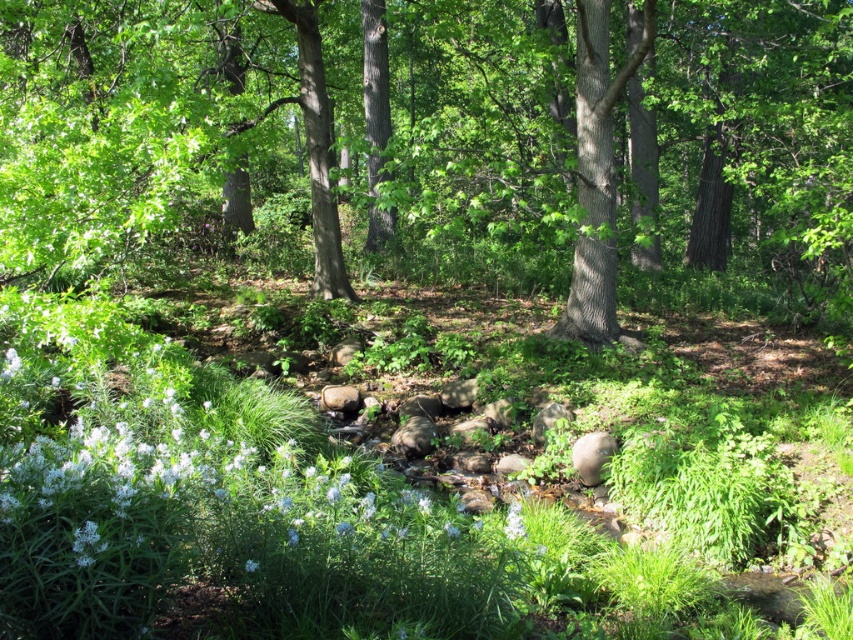
Question: Does green leafy tree at center have a larger size compared to white matte flower at center?

Choices:
 (A) no
 (B) yes

Answer: (B)

Question: Which point appears closest to the camera in this image?

Choices:
 (A) click(604, 17)
 (B) click(517, 524)
 (C) click(590, 70)

Answer: (B)

Question: Which of the following is the farthest from the observer?

Choices:
 (A) (508, 536)
 (B) (250, 560)
 (C) (560, 321)

Answer: (C)

Question: Which is farther from the smooth bark tree at center?

Choices:
 (A) white matte flower at center
 (B) white matte flower at lower center

Answer: (B)

Question: Does green leafy tree at center appear on the left side of white matte flower at lower center?

Choices:
 (A) no
 (B) yes

Answer: (B)

Question: Does green leafy tree at center lie in front of white matte flower at lower center?

Choices:
 (A) no
 (B) yes

Answer: (A)